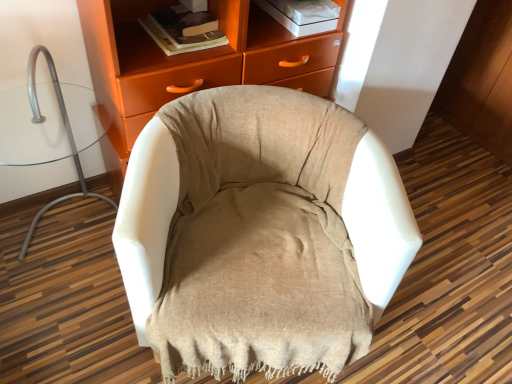
Question: Does white fabric chair at left appear on the right side of matte orange cabinet at upper center?

Choices:
 (A) yes
 (B) no

Answer: (B)

Question: From a real-world perspective, is white fabric chair at left located beneath matte orange cabinet at upper center?

Choices:
 (A) no
 (B) yes

Answer: (B)

Question: Is white fabric chair at left bigger than matte orange cabinet at upper center?

Choices:
 (A) yes
 (B) no

Answer: (B)

Question: From the image's perspective, is white fabric chair at left beneath matte orange cabinet at upper center?

Choices:
 (A) yes
 (B) no

Answer: (A)

Question: Can you confirm if white fabric chair at left is taller than matte orange cabinet at upper center?

Choices:
 (A) no
 (B) yes

Answer: (A)

Question: Based on their positions, is beige fabric chair at center located to the left or right of hardcover book at upper center?

Choices:
 (A) right
 (B) left

Answer: (A)

Question: In terms of width, does beige fabric chair at center look wider or thinner when compared to hardcover book at upper center?

Choices:
 (A) wide
 (B) thin

Answer: (A)

Question: Is point [x=195, y=274] positioned closer to the camera than point [x=157, y=26]?

Choices:
 (A) closer
 (B) farther

Answer: (A)

Question: Considering the positions of beige fabric chair at center and hardcover book at upper center in the image, is beige fabric chair at center taller or shorter than hardcover book at upper center?

Choices:
 (A) tall
 (B) short

Answer: (A)

Question: Considering the relative positions of beige fabric chair at center and white fabric chair at left in the image provided, is beige fabric chair at center to the left or to the right of white fabric chair at left?

Choices:
 (A) right
 (B) left

Answer: (A)

Question: Looking at their shapes, would you say beige fabric chair at center is wider or thinner than white fabric chair at left?

Choices:
 (A) wide
 (B) thin

Answer: (A)

Question: From a real-world perspective, is beige fabric chair at center above or below white fabric chair at left?

Choices:
 (A) below
 (B) above

Answer: (A)

Question: Is beige fabric chair at center in front of or behind white fabric chair at left in the image?

Choices:
 (A) behind
 (B) front

Answer: (B)

Question: From the image's perspective, is matte orange cabinet at upper center above or below white fabric chair at left?

Choices:
 (A) above
 (B) below

Answer: (A)

Question: Is point (148, 92) closer or farther from the camera than point (92, 195)?

Choices:
 (A) farther
 (B) closer

Answer: (B)